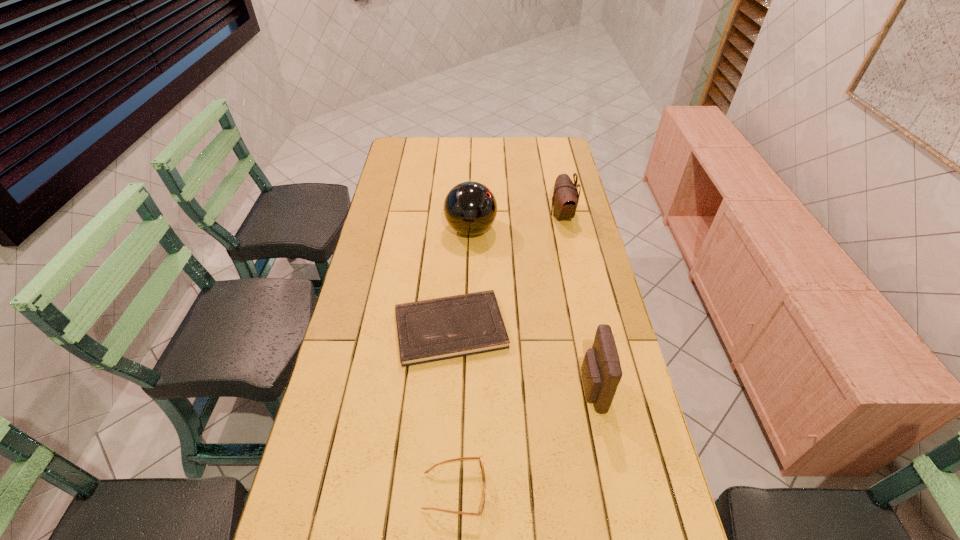
Select which object is the fourth closest to the nearer pouch. Please provide its 2D coordinates. Your answer should be formatted as a tuple, i.e. [(x, y)], where the tuple contains the x and y coordinates of a point satisfying the conditions above.

[(565, 198)]

The width and height of the screenshot is (960, 540). I want to click on vacant region that satisfies the following two spatial constraints: 1. with the flap open on the farther pouch; 2. on the front side of the paperback book, so click(587, 328).